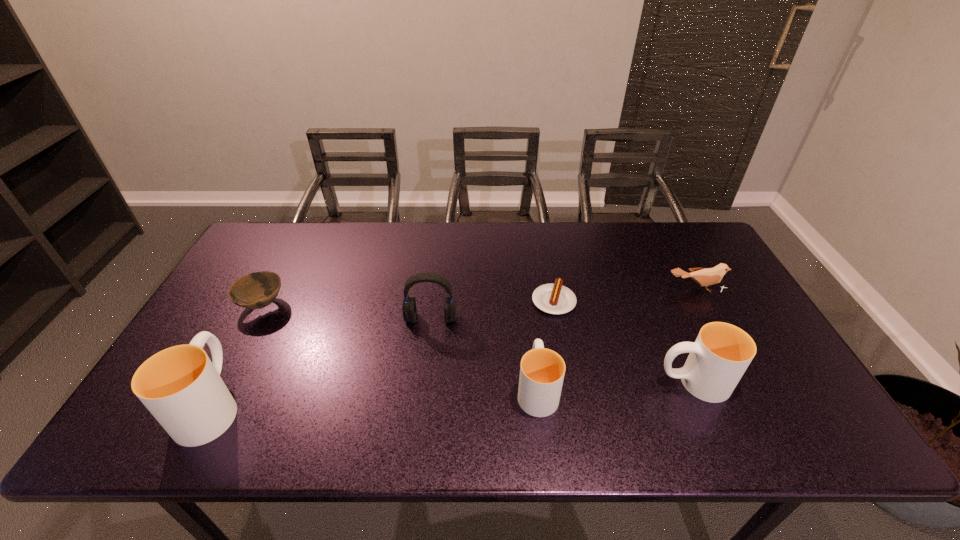
In order to click on vacant space situated at the beak of the third shortest object in this screenshot , I will do `click(758, 404)`.

This screenshot has height=540, width=960. I want to click on cup at the left edge, so click(180, 386).

Image resolution: width=960 pixels, height=540 pixels. In order to click on bowl that is at the left edge in this screenshot , I will do `click(257, 290)`.

At what (x,y) coordinates should I click in order to perform the action: click on object located in the right edge section of the desktop. Please return your answer as a coordinate pair (x, y). This screenshot has height=540, width=960. Looking at the image, I should click on (704, 276).

Identify the location of object at the near left corner. The height and width of the screenshot is (540, 960). (180, 386).

Identify the location of blank space at the far edge of the desktop. The width and height of the screenshot is (960, 540). (461, 257).

Where is `vacant space at the right edge of the desktop`? vacant space at the right edge of the desktop is located at coordinates (772, 356).

Locate an element on the screen. The width and height of the screenshot is (960, 540). free space at the far left corner of the desktop is located at coordinates 304,225.

You are a GUI agent. You are given a task and a screenshot of the screen. Output one action in this format:
    pyautogui.click(x=<x>, y=<y>)
    Task: Click on the free space at the near left corner of the desktop
    
    Given the screenshot: What is the action you would take?
    pyautogui.click(x=224, y=380)

Identify the location of free space at the far right corner. The width and height of the screenshot is (960, 540). (657, 236).